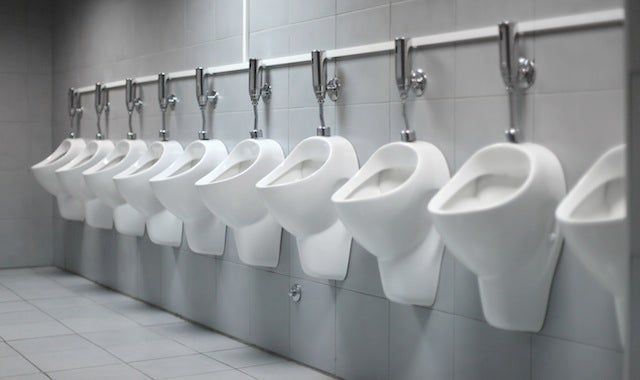
The height and width of the screenshot is (380, 640). I want to click on metal lever to flush urinal, so click(70, 103), click(100, 100), click(131, 100), click(159, 88), click(196, 91), click(248, 71), click(321, 80), click(401, 64), click(512, 49).